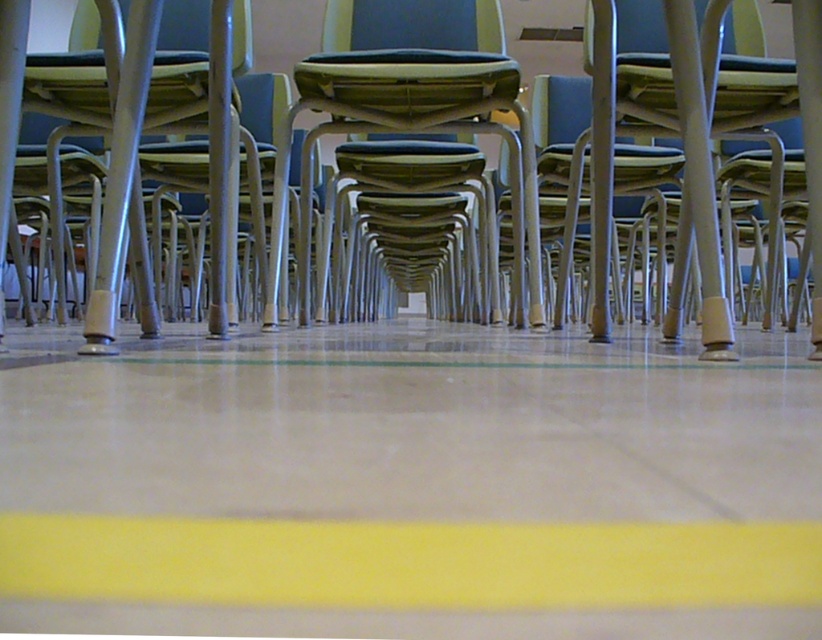
Question: Is yellow matte line at lower center thinner than metallic gray chair at center?

Choices:
 (A) no
 (B) yes

Answer: (A)

Question: Which point appears closest to the camera in this image?

Choices:
 (A) (695, 161)
 (B) (396, 554)
 (C) (299, 106)

Answer: (B)

Question: Among these points, which one is nearest to the camera?

Choices:
 (A) (516, 182)
 (B) (689, 163)

Answer: (B)

Question: Does yellow matte line at lower center lie behind matte black chair at center?

Choices:
 (A) yes
 (B) no

Answer: (B)

Question: Where is yellow matte line at lower center located in relation to metallic gray chair at center in the image?

Choices:
 (A) left
 (B) right

Answer: (A)

Question: Which point appears farthest from the camera in this image?

Choices:
 (A) (700, 582)
 (B) (459, 60)
 (C) (127, 129)

Answer: (B)